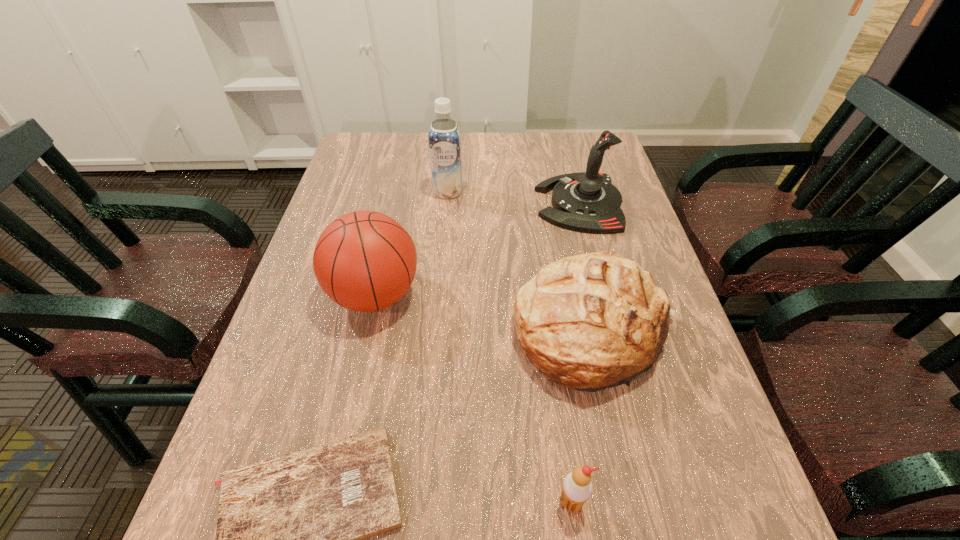
You are a GUI agent. You are given a task and a screenshot of the screen. Output one action in this format:
    pyautogui.click(x=<x>, y=<y>)
    Task: Click on the soya milk
    Image resolution: width=960 pixels, height=540 pixels.
    Given the screenshot: What is the action you would take?
    pyautogui.click(x=444, y=134)

This screenshot has width=960, height=540. I want to click on joystick, so click(x=588, y=202).

The image size is (960, 540). I want to click on basketball, so click(365, 261).

What are the coordinates of `bread` in the screenshot? It's located at (592, 321).

This screenshot has width=960, height=540. Find the location of `the second shortest object`. the second shortest object is located at coordinates click(577, 487).

Find the location of a particular element. The image size is (960, 540). vacant space located on the label of the tallest object is located at coordinates (441, 278).

Find the location of a particular element. Image resolution: width=960 pixels, height=540 pixels. free point located 0.130m on the handle side of the joystick is located at coordinates (491, 204).

The image size is (960, 540). What are the coordinates of `free spot located on the handle side of the joystick` in the screenshot? It's located at (473, 204).

Where is `free location located on the handle side of the joystick`? The image size is (960, 540). free location located on the handle side of the joystick is located at coordinates (423, 204).

At what (x,y) coordinates should I click in order to perform the action: click on vacant space located on the front of the basketball. Please return your answer as a coordinate pair (x, y). The image size is (960, 540). Looking at the image, I should click on (357, 377).